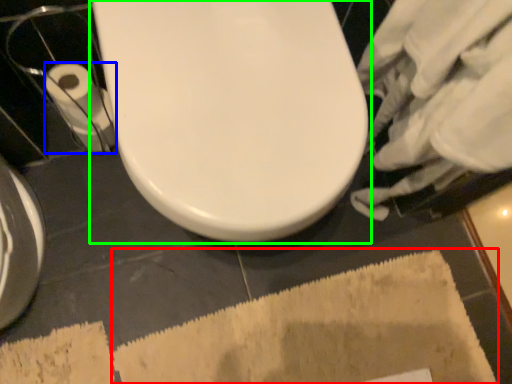
Question: Which object is the closest to the bath mat (highlighted by a red box)? Choose among these: toilet paper (highlighted by a blue box) or toilet (highlighted by a green box).

Choices:
 (A) toilet paper
 (B) toilet

Answer: (B)